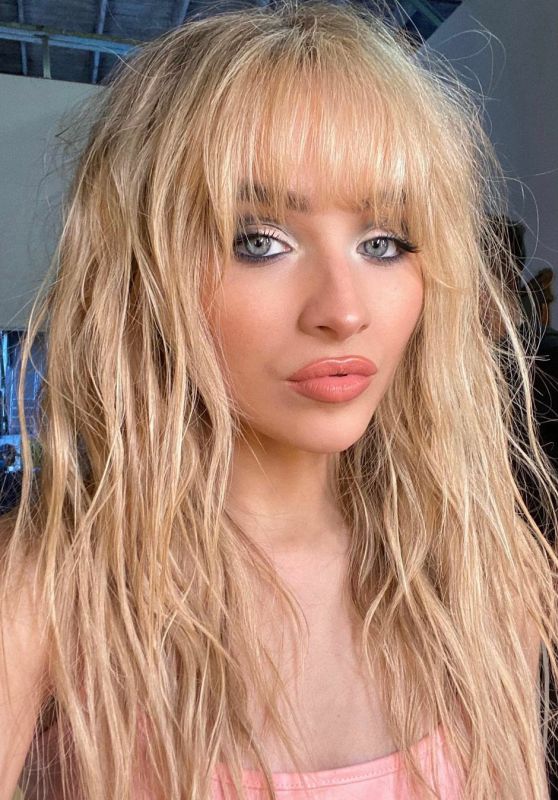
At what (x,y) coordinates should I click in order to perform the action: click on door. Please return your answer as a coordinate pair (x, y). This screenshot has width=558, height=800. Looking at the image, I should click on (4, 404).